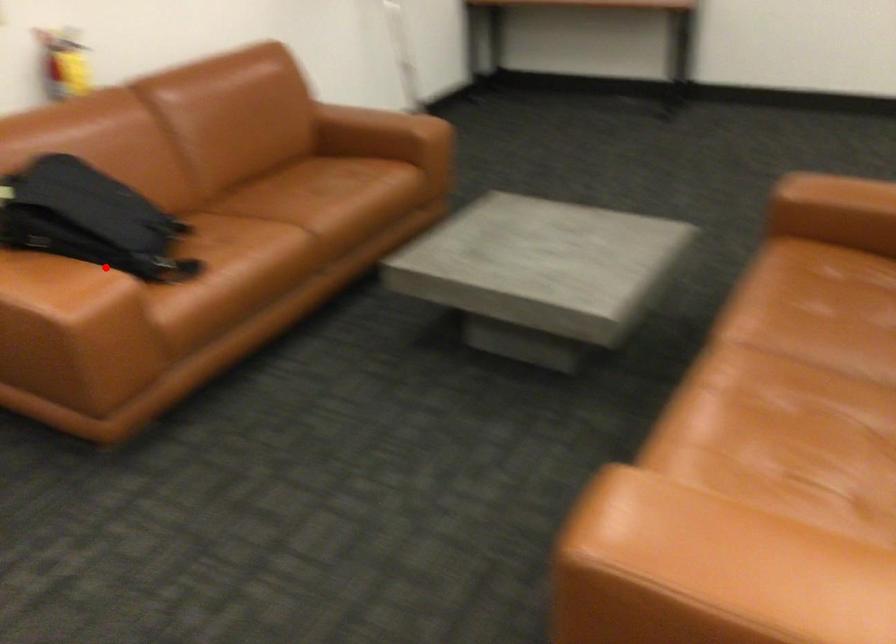
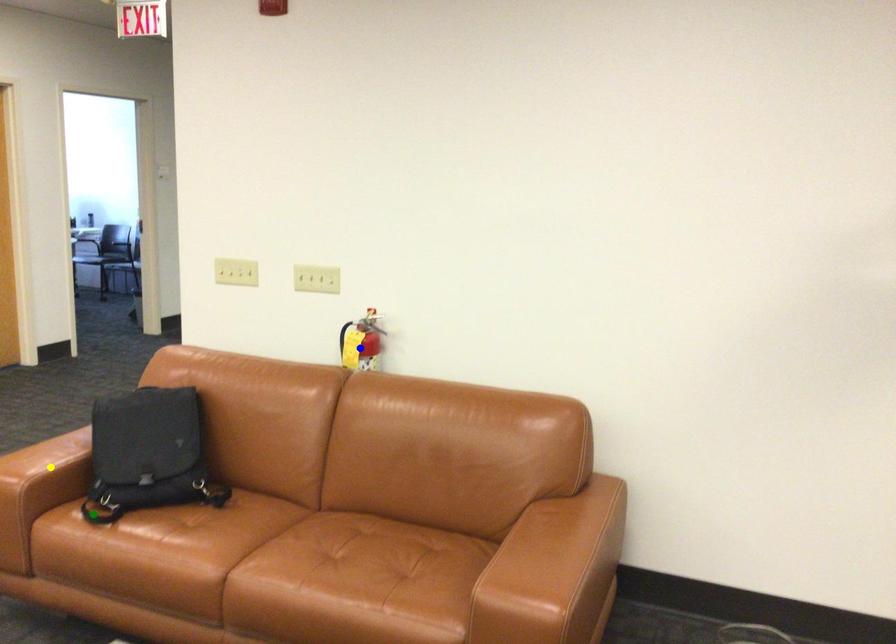
Question: I am providing you with two images of the same scene from different viewpoints. A red point is marked on the first image. You are given multiple points on the second image. Which point in image 2 is actually the same real-world point as the red point in image 1?

Choices:
 (A) green point
 (B) blue point
 (C) yellow point

Answer: (C)